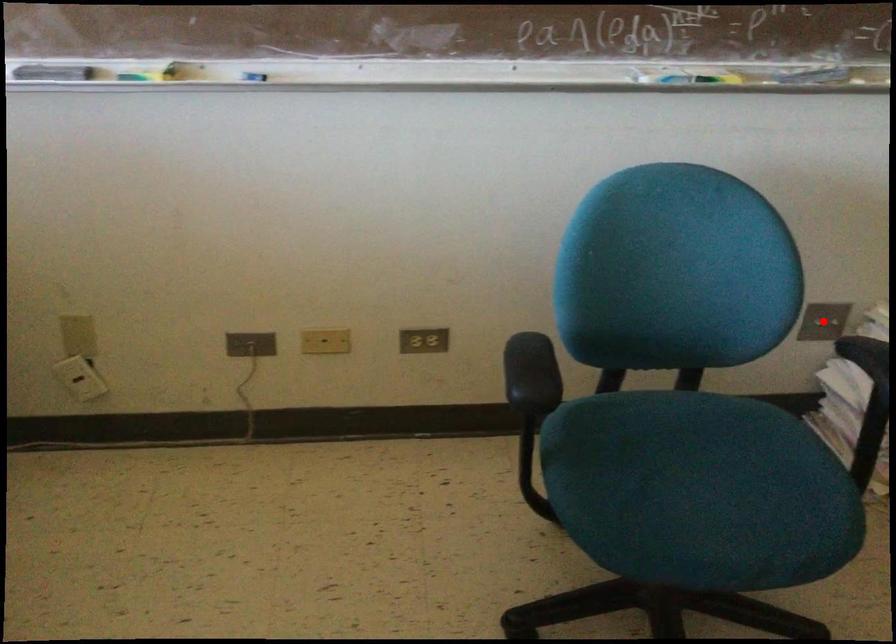
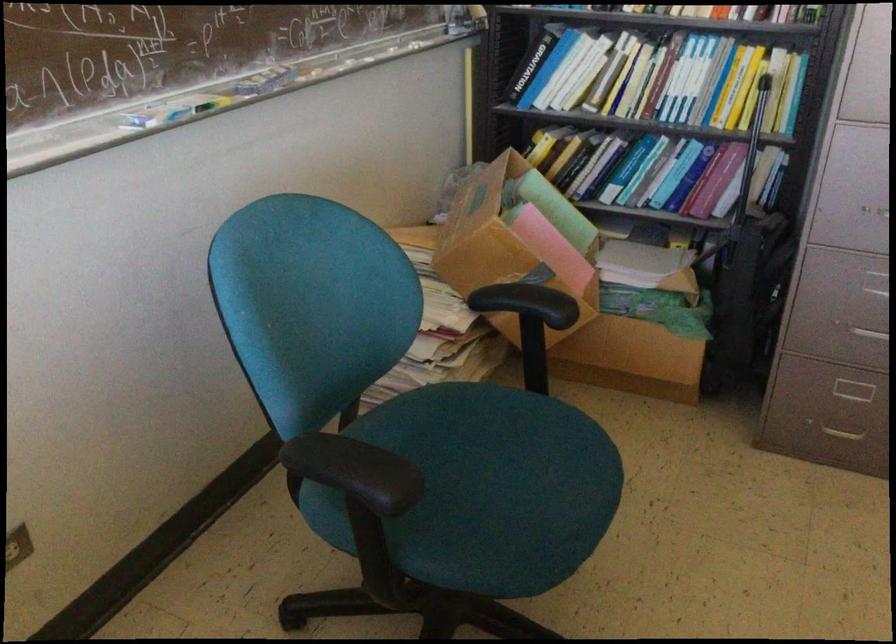
Question: I am providing you with two images of the same scene from different viewpoints. A red point is marked on the first image. Is the red point's position out of view in image 2?

Choices:
 (A) Yes
 (B) No

Answer: (A)